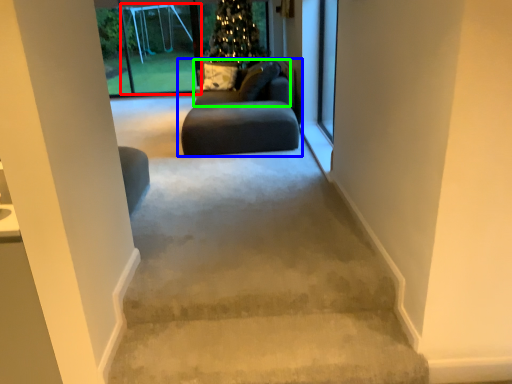
Question: Considering the real-world distances, which object is closest to screen door (highlighted by a red box)? studio couch (highlighted by a blue box) or couch (highlighted by a green box).

Choices:
 (A) studio couch
 (B) couch

Answer: (B)